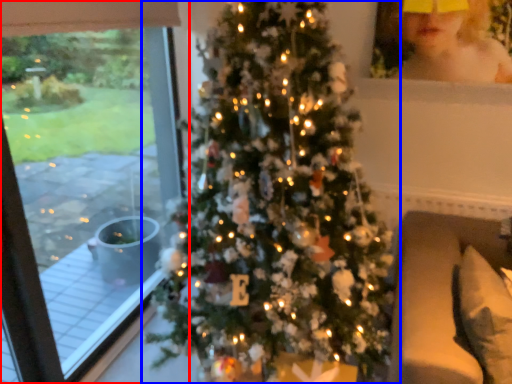
Question: Which of the following is the farthest to the observer, window (highlighted by a red box) or christmas tree (highlighted by a blue box)?

Choices:
 (A) window
 (B) christmas tree

Answer: (A)